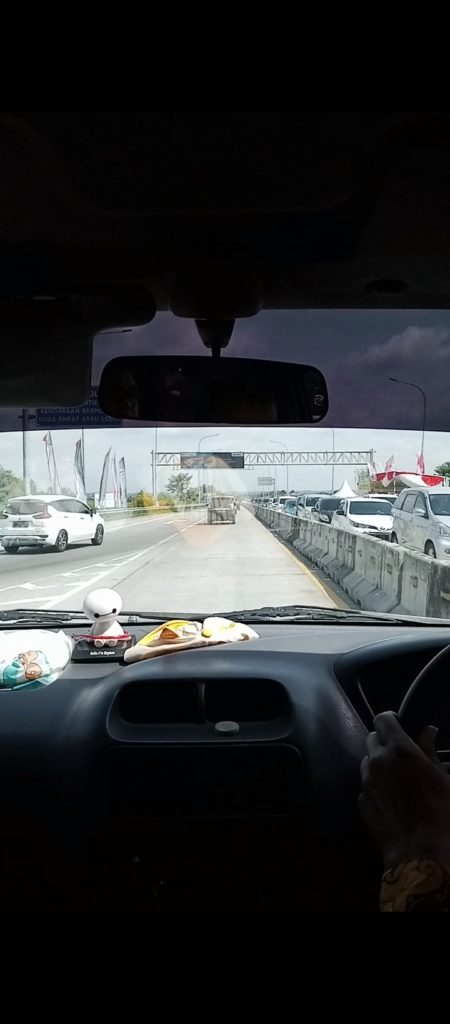
The image size is (450, 1024). What are the coordinates of `vent` in the screenshot? It's located at (246, 701), (175, 697).